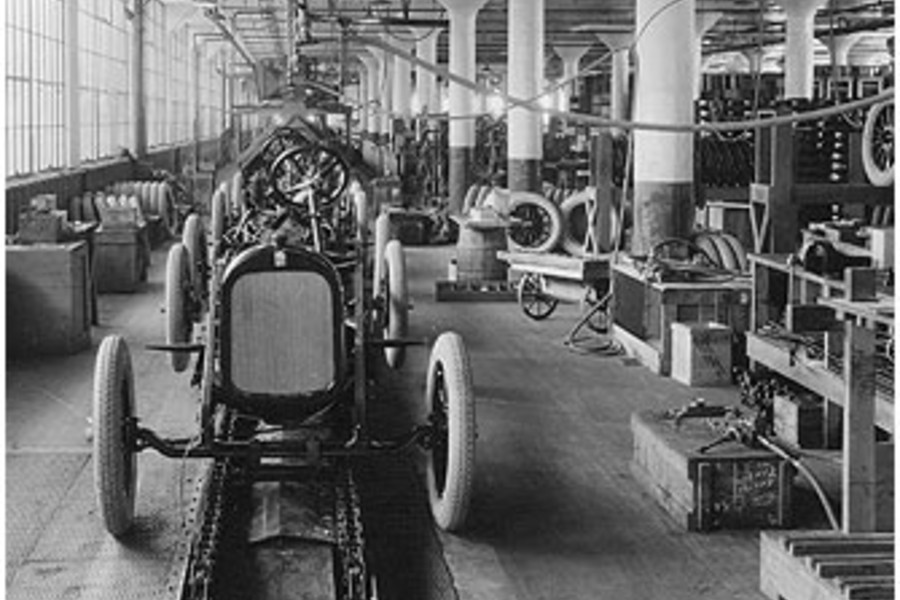
At what (x,y) coordinates should I click in order to perform the action: click on window. Please return your answer as a coordinate pair (x, y). This screenshot has height=600, width=900. Looking at the image, I should click on (x=60, y=111).